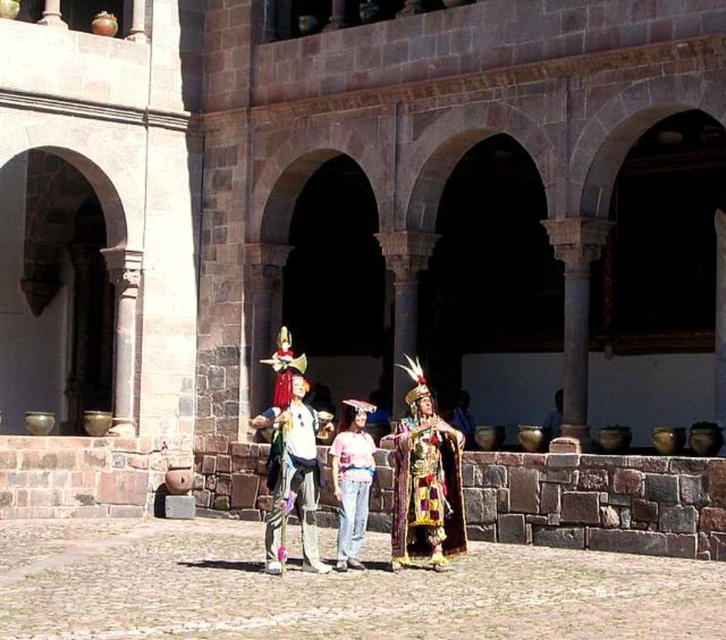
Question: Can you confirm if matte white shirt at center is positioned below pink fabric costume at center?

Choices:
 (A) no
 (B) yes

Answer: (A)

Question: Which of the following is the farthest from the observer?

Choices:
 (A) smooth stone courtyard at center
 (B) shiny gold fabric at center
 (C) pink fabric costume at center
 (D) matte white shirt at center

Answer: (C)

Question: Which of the following is the farthest from the observer?

Choices:
 (A) matte white shirt at center
 (B) shiny gold fabric at center
 (C) pink fabric costume at center
 (D) smooth stone courtyard at center

Answer: (C)

Question: Which object appears farthest from the camera in this image?

Choices:
 (A) matte white shirt at center
 (B) pink fabric costume at center
 (C) shiny gold fabric at center
 (D) smooth stone courtyard at center

Answer: (B)

Question: Is smooth stone courtyard at center above matte white shirt at center?

Choices:
 (A) no
 (B) yes

Answer: (A)

Question: Is smooth stone courtyard at center further to the viewer compared to pink fabric costume at center?

Choices:
 (A) no
 (B) yes

Answer: (A)